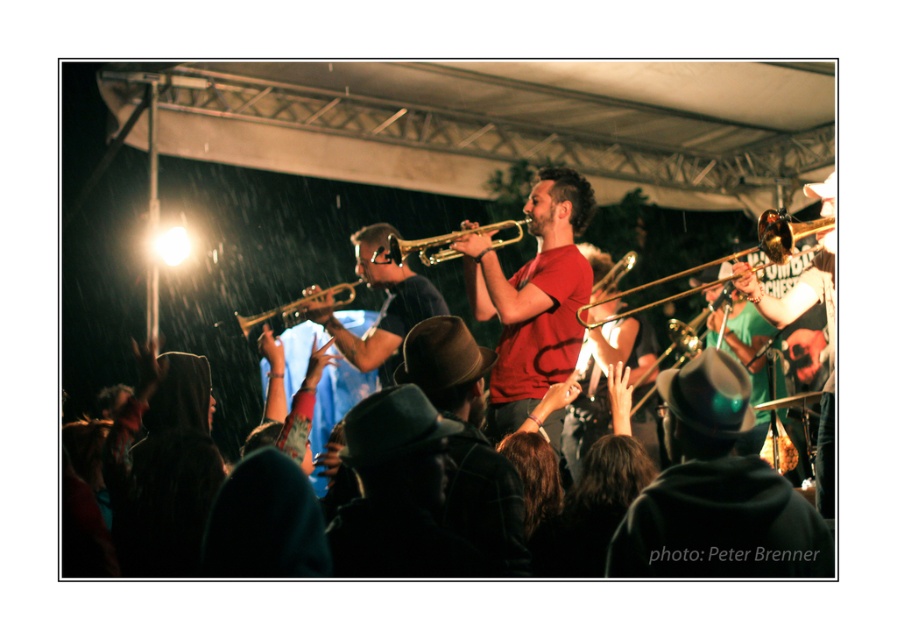
You are a photographer at the concert and want to capture both the black matte hat at center and the shiny brass trumpet at center in a single frame. Since your camera has a limited focus range, you need to know which object is larger to ensure proper focus. Which one is bigger?

The black matte hat at center is bigger than the shiny brass trumpet at center, so you should focus on the black matte hat at center to ensure proper focus.

You are at the center of the concert venue and want to find the black matte hat at center. In which direction should you look to locate it?

The black matte hat at center is located at the coordinates point [716,493], so you should look towards the lower right direction from the center to find it.